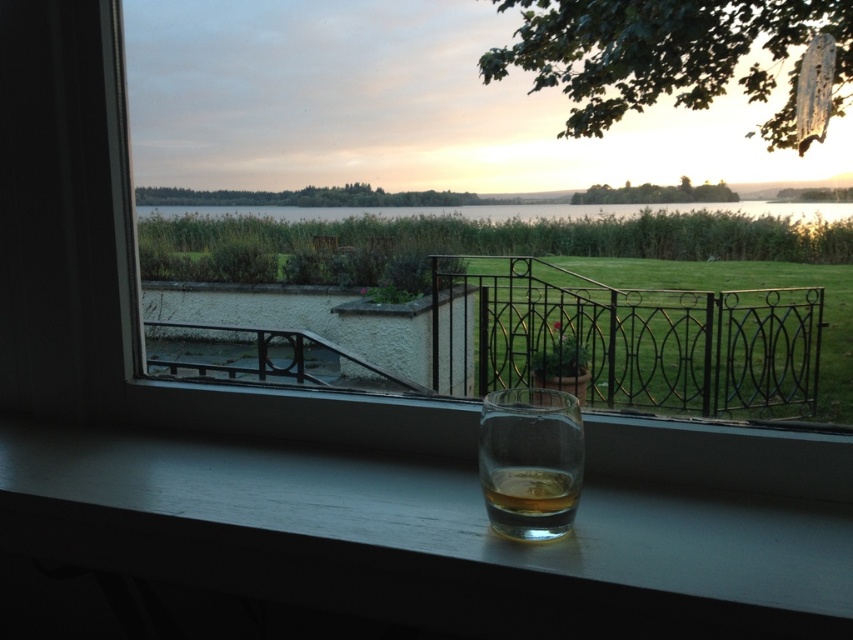
You are trying to place a decorative plate on the smooth wood window sill at lower center next to the translucent glass at lower center. Based on their widths, will there be enough space for the plate?

The smooth wood window sill at lower center is wider than the translucent glass at lower center, so there should be enough space to place the decorative plate next to it.

You are standing in front of the window and notice two points marked in the scene. The first point is at coordinates point (4, 426) and the second is at point (450, 212). Which point is closer to you?

Point (4, 426) is closer to the viewer than point (450, 212).